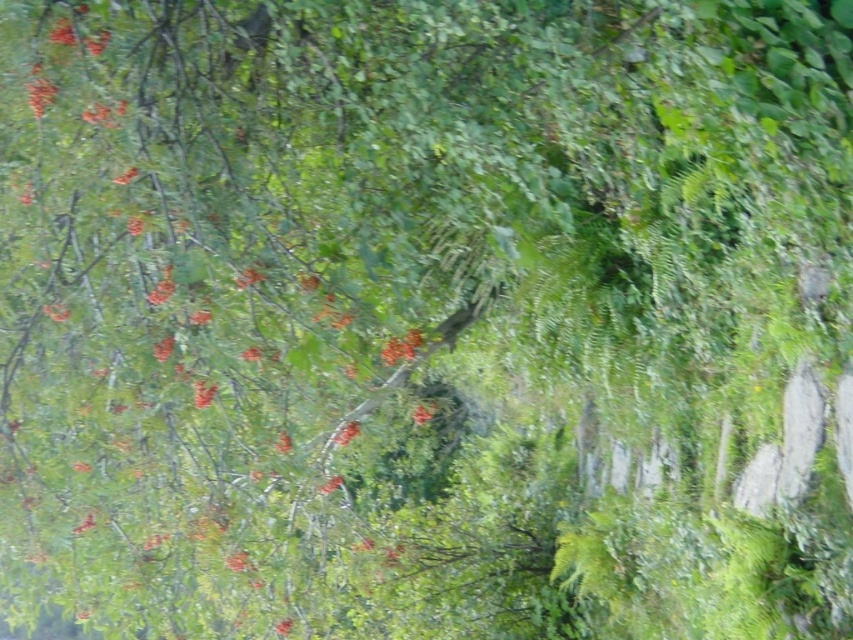
Does glossy red flower at center come behind orange matte flower at center?

No, it is not.

Which is below, glossy red flower at center or orange matte flower at center?

orange matte flower at center

Find the location of `glossy red flower at center`. glossy red flower at center is located at coordinates (401, 348).

Between point (352, 422) and point (424, 404), which one is positioned in front?

Point (352, 422) is more forward.

Who is shorter, orange matte flower at center or bright orange berries at center?

With less height is orange matte flower at center.

The image size is (853, 640). What do you see at coordinates (346, 433) in the screenshot?
I see `orange matte flower at center` at bounding box center [346, 433].

Where is `orange matte flower at center`? This screenshot has width=853, height=640. orange matte flower at center is located at coordinates tap(346, 433).

Who is positioned more to the left, glossy red flower at center or bright orange berries at center?

bright orange berries at center is more to the left.

Who is shorter, glossy red flower at center or bright orange berries at center?

glossy red flower at center

Image resolution: width=853 pixels, height=640 pixels. Find the location of `glossy red flower at center`. glossy red flower at center is located at coordinates (401, 348).